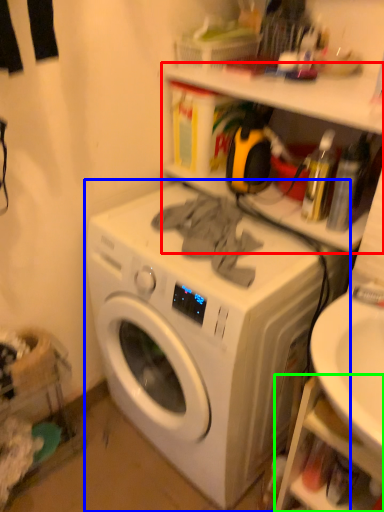
Question: Which object is positioned farthest from shelf (highlighted by a red box)? Select from washing machine (highlighted by a blue box) and shelf (highlighted by a green box).

Choices:
 (A) washing machine
 (B) shelf

Answer: (B)